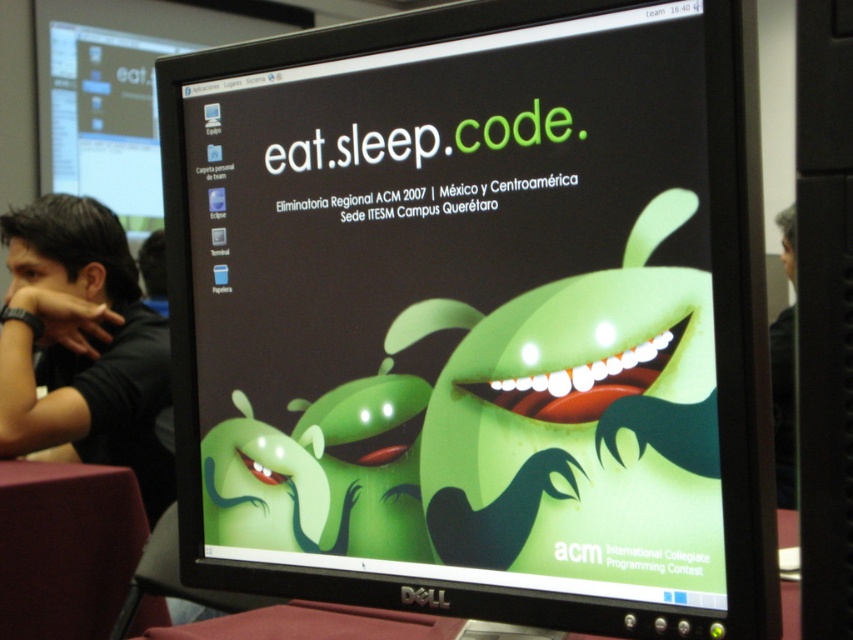
Question: Which object appears closest to the camera in this image?

Choices:
 (A) black shirt at left
 (B) green matte screen at center

Answer: (B)

Question: Is black shirt at left further to the viewer compared to maroon fabric table at lower left?

Choices:
 (A) no
 (B) yes

Answer: (B)

Question: Estimate the real-world distances between objects in this image. Which object is closer to the green matte screen at center?

Choices:
 (A) maroon fabric table at lower left
 (B) black shirt at left

Answer: (A)

Question: Is black shirt at left further to the viewer compared to maroon fabric table at lower left?

Choices:
 (A) no
 (B) yes

Answer: (B)

Question: Considering the relative positions of green matte screen at center and maroon fabric table at lower left in the image provided, where is green matte screen at center located with respect to maroon fabric table at lower left?

Choices:
 (A) above
 (B) below

Answer: (A)

Question: Which of the following is the closest to the observer?

Choices:
 (A) maroon fabric table at lower left
 (B) black shirt at left
 (C) green matte screen at center

Answer: (C)